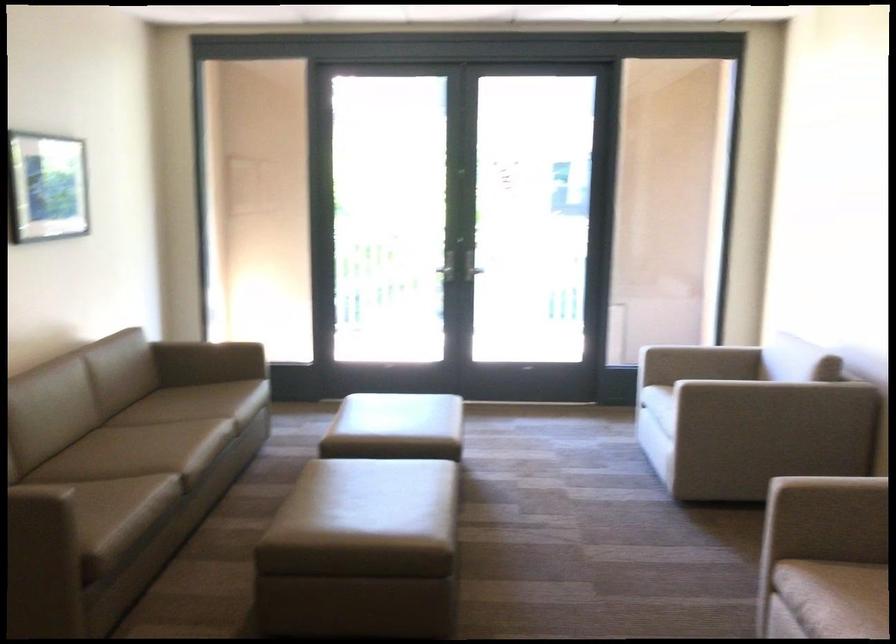
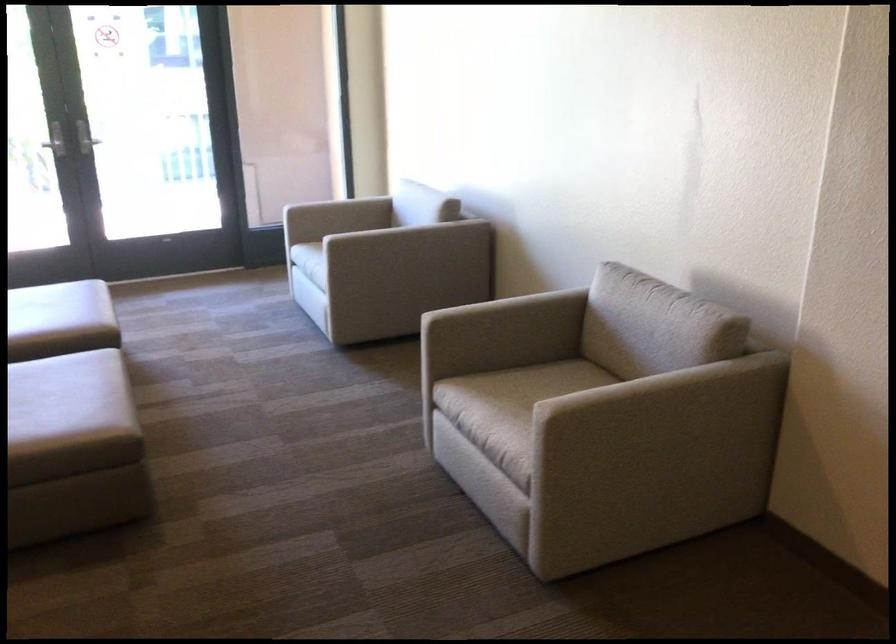
The point at (x=674, y=389) is marked in the first image. Where is the corresponding point in the second image?

(316, 240)